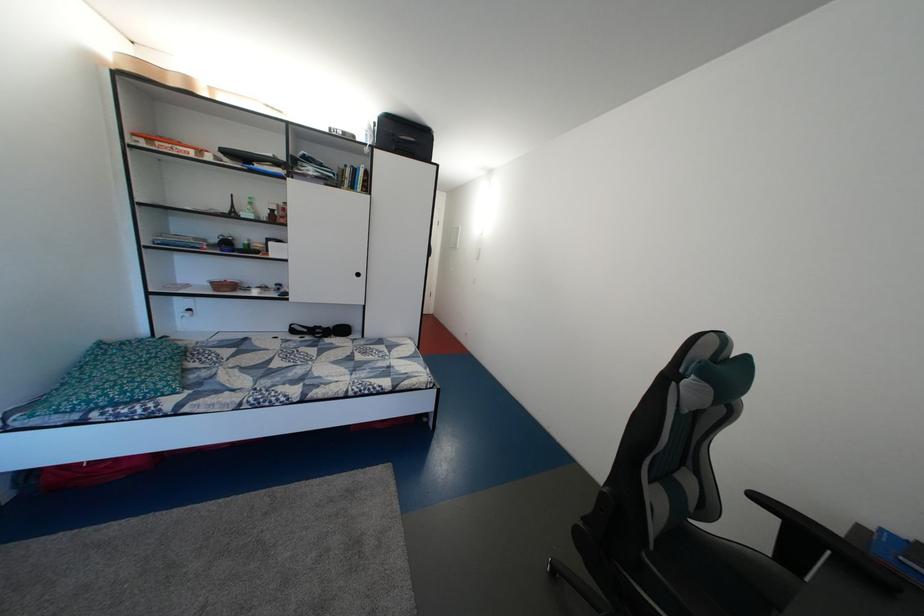
Describe the element at coordinates (185, 313) in the screenshot. I see `the white electrical outlet` at that location.